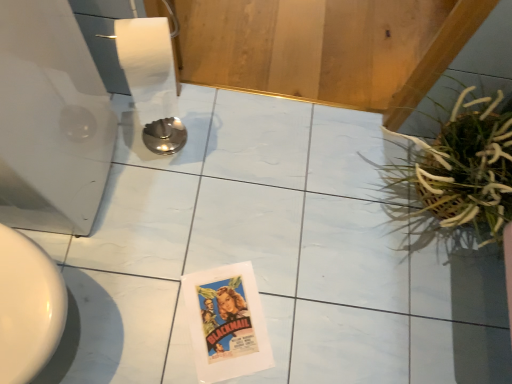
Question: Considering the positions of green leafy plant at right and white glossy toilet at left in the image, is green leafy plant at right taller or shorter than white glossy toilet at left?

Choices:
 (A) short
 (B) tall

Answer: (A)

Question: Is point (464, 105) positioned closer to the camera than point (56, 110)?

Choices:
 (A) farther
 (B) closer

Answer: (A)

Question: From a real-world perspective, is green leafy plant at right positioned above or below white glossy toilet at left?

Choices:
 (A) below
 (B) above

Answer: (A)

Question: Visually, is white glossy toilet at left positioned to the left or to the right of green leafy plant at right?

Choices:
 (A) right
 (B) left

Answer: (B)

Question: In terms of width, does white glossy toilet at left look wider or thinner when compared to green leafy plant at right?

Choices:
 (A) thin
 (B) wide

Answer: (B)

Question: Would you say white glossy toilet at left is inside or outside green leafy plant at right?

Choices:
 (A) inside
 (B) outside

Answer: (B)

Question: Is point (34, 203) closer or farther from the camera than point (425, 175)?

Choices:
 (A) farther
 (B) closer

Answer: (B)